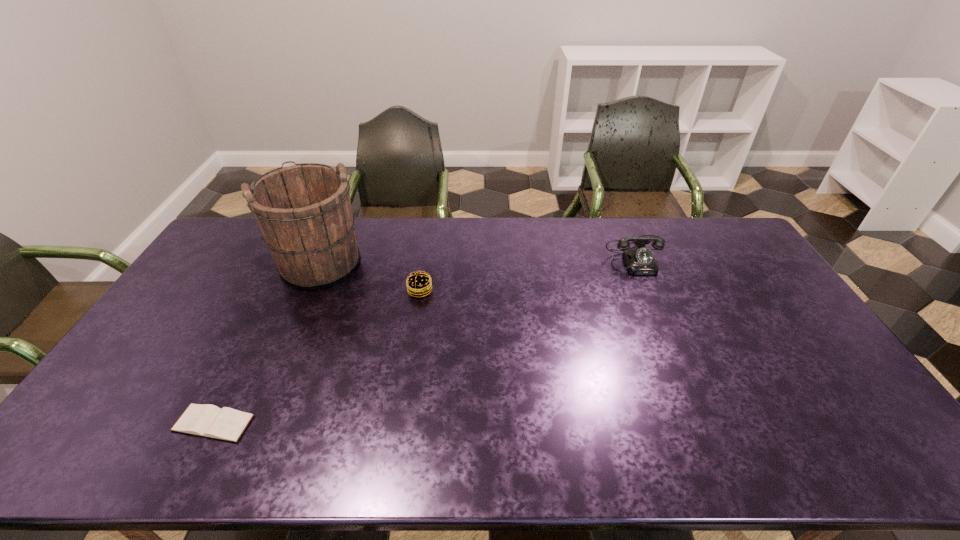
Locate an element on the screen. This screenshot has height=540, width=960. bucket is located at coordinates coord(304,212).

The image size is (960, 540). In order to click on the third shortest object in this screenshot , I will do `click(639, 260)`.

Identify the location of telephone. (639, 260).

You are a GUI agent. You are given a task and a screenshot of the screen. Output one action in this format:
    pyautogui.click(x=<x>, y=<y>)
    Task: Click on the second object from right to left
    This screenshot has width=960, height=540.
    Given the screenshot: What is the action you would take?
    point(418,284)

You are a GUI agent. You are given a task and a screenshot of the screen. Output one action in this format:
    pyautogui.click(x=<x>, y=<y>)
    Task: Click on the patty
    This screenshot has width=960, height=540.
    Given the screenshot: What is the action you would take?
    pyautogui.click(x=418, y=284)

Where is `the shortest object`? The width and height of the screenshot is (960, 540). the shortest object is located at coordinates pyautogui.click(x=206, y=420).

Find the location of a particular element. diary is located at coordinates (206, 420).

At what (x,y) coordinates should I click in order to perform the action: click on blank space located on the front of the bucket. Please return your answer as a coordinate pair (x, y). Looking at the image, I should click on (300, 306).

Locate an element on the screen. The image size is (960, 540). free space located 0.340m on the front-facing side of the rightmost object is located at coordinates (681, 354).

Identify the location of vacant area situated on the left of the third object from left to right. (380, 291).